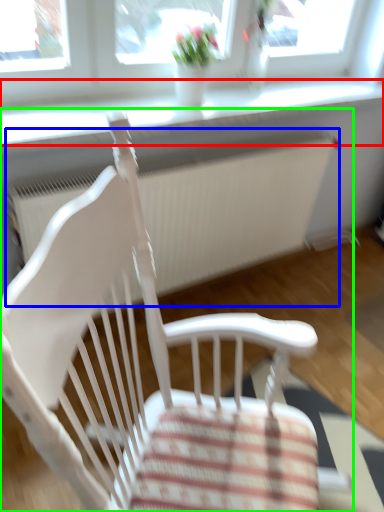
Question: Considering the real-world distances, which object is farthest from window sill (highlighted by a red box)? radiator (highlighted by a blue box) or chair (highlighted by a green box)?

Choices:
 (A) radiator
 (B) chair

Answer: (B)